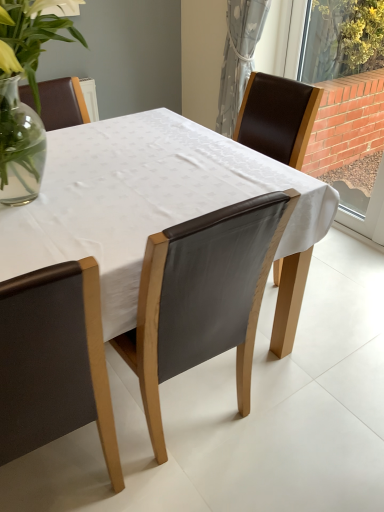
The width and height of the screenshot is (384, 512). Describe the element at coordinates (203, 298) in the screenshot. I see `leather at center, which appears as the second chair when viewed from the left` at that location.

Describe the element at coordinates (238, 57) in the screenshot. I see `gray textured curtain at upper right` at that location.

What is the approximate width of matte brown leather chair at lower left, placed as the 1th chair when sorted from left to right?

10.58 inches.

Find the location of `leather at center, which appears as the second chair when viewed from the left`. leather at center, which appears as the second chair when viewed from the left is located at coordinates (203, 298).

Does point (175, 360) lie in front of point (72, 276)?

No, (175, 360) is further to viewer.

Can you confirm if leather at center, which appears as the second chair when viewed from the left, is bigger than matte brown leather chair at lower left, which is the 2th chair from right to left?

Yes, leather at center, which appears as the second chair when viewed from the left, is bigger than matte brown leather chair at lower left, which is the 2th chair from right to left.

Between leather at center, which appears as the second chair when viewed from the left, and matte brown leather chair at lower left, which is the 2th chair from right to left, which one appears on the right side from the viewer's perspective?

leather at center, which appears as the second chair when viewed from the left.

Considering the sizes of objects matte brown leather chair at lower left, which is the 2th chair from right to left, and leather at center, arranged as the first chair when viewed from the right, in the image provided, who is shorter, matte brown leather chair at lower left, which is the 2th chair from right to left, or leather at center, arranged as the first chair when viewed from the right,?

With less height is leather at center, arranged as the first chair when viewed from the right.

Is matte brown leather chair at lower left, which is the 2th chair from right to left, positioned far away from leather at center, arranged as the first chair when viewed from the right?

Actually, matte brown leather chair at lower left, which is the 2th chair from right to left, and leather at center, arranged as the first chair when viewed from the right, are a little close together.

Is matte brown leather chair at lower left, placed as the 1th chair when sorted from left to right, oriented away from leather at center, which appears as the second chair when viewed from the left?

matte brown leather chair at lower left, placed as the 1th chair when sorted from left to right, is not turned away from leather at center, which appears as the second chair when viewed from the left.

Is leather at center, arranged as the first chair when viewed from the right, placed right next to brick wall at right?

No, leather at center, arranged as the first chair when viewed from the right, is not making contact with brick wall at right.

Looking at their sizes, would you say leather at center, which appears as the second chair when viewed from the left, is wider or thinner than brick wall at right?

Considering their sizes, leather at center, which appears as the second chair when viewed from the left, looks broader than brick wall at right.

Looking at this image, between leather at center, which appears as the second chair when viewed from the left, and brick wall at right, which one has more height?

Standing taller between the two is brick wall at right.

Does point (199, 313) appear closer or farther from the camera than point (316, 140)?

Point (199, 313) appears to be closer to the viewer than point (316, 140).

From a real-world perspective, is brick wall at right above or below leather at center, which appears as the second chair when viewed from the left?

From a real-world perspective, brick wall at right is physically above leather at center, which appears as the second chair when viewed from the left.

Is point (372, 160) positioned before point (150, 435)?

That is False.

Is leather at center, which appears as the second chair when viewed from the left, at the back of brick wall at right?

brick wall at right is not turned away from leather at center, which appears as the second chair when viewed from the left.

Is brick wall at right located outside leather at center, arranged as the first chair when viewed from the right?

Yes, brick wall at right is outside of leather at center, arranged as the first chair when viewed from the right.

From the image's perspective, would you say gray textured curtain at upper right is shown under matte brown leather chair at lower left, placed as the 1th chair when sorted from left to right?

No, from the image's perspective, gray textured curtain at upper right is not beneath matte brown leather chair at lower left, placed as the 1th chair when sorted from left to right.

You are a GUI agent. You are given a task and a screenshot of the screen. Output one action in this format:
    pyautogui.click(x=<x>, y=<y>)
    Task: Click on the curtain above the matte brown leather chair at lower left, placed as the 1th chair when sorted from left to right (from a real-world perspective)
    
    Given the screenshot: What is the action you would take?
    pyautogui.click(x=238, y=57)

Which is in front, point (230, 70) or point (26, 329)?

The point (26, 329) is in front.

Is matte brown leather chair at lower left, placed as the 1th chair when sorted from left to right, surrounding brick wall at right?

No, brick wall at right is located outside of matte brown leather chair at lower left, placed as the 1th chair when sorted from left to right.

Is point (41, 321) farther from camera compared to point (346, 49)?

No, (41, 321) is in front of (346, 49).

What's the angular difference between matte brown leather chair at lower left, placed as the 1th chair when sorted from left to right, and brick wall at right's facing directions?

92.7 degrees.

From a real-world perspective, which is physically below, matte brown leather chair at lower left, which is the 2th chair from right to left, or gray textured curtain at upper right?

matte brown leather chair at lower left, which is the 2th chair from right to left, is physically lower.

Does matte brown leather chair at lower left, placed as the 1th chair when sorted from left to right, lie behind gray textured curtain at upper right?

No.

Is matte brown leather chair at lower left, placed as the 1th chair when sorted from left to right, positioned beyond the bounds of gray textured curtain at upper right?

That's correct, matte brown leather chair at lower left, placed as the 1th chair when sorted from left to right, is outside of gray textured curtain at upper right.

Between matte brown leather chair at lower left, which is the 2th chair from right to left, and gray textured curtain at upper right, which one has smaller size?

With smaller size is gray textured curtain at upper right.

Where is `chair behind the matte brown leather chair at lower left, placed as the 1th chair when sorted from left to right`? chair behind the matte brown leather chair at lower left, placed as the 1th chair when sorted from left to right is located at coordinates (203, 298).

Where is `chair that is in front of the leather at center, arranged as the first chair when viewed from the right`? This screenshot has width=384, height=512. chair that is in front of the leather at center, arranged as the first chair when viewed from the right is located at coordinates (54, 361).

Which object lies nearer to the anchor point gray textured curtain at upper right, matte brown leather chair at lower left, which is the 2th chair from right to left, or white fabric table at center?

The object closer to gray textured curtain at upper right is white fabric table at center.

Considering their positions, is leather at center, which appears as the second chair when viewed from the left, positioned further to brick wall at right than gray textured curtain at upper right?

leather at center, which appears as the second chair when viewed from the left, is further to brick wall at right.

Looking at the image, which one is located further to leather at center, arranged as the first chair when viewed from the right, white fabric table at center or matte brown leather chair at lower left, which is the 2th chair from right to left?

Based on the image, white fabric table at center appears to be further to leather at center, arranged as the first chair when viewed from the right.

Looking at the image, which one is located closer to white fabric table at center, matte brown leather chair at lower left, placed as the 1th chair when sorted from left to right, or brick wall at right?

matte brown leather chair at lower left, placed as the 1th chair when sorted from left to right, is positioned closer to the anchor white fabric table at center.

Looking at the image, which one is located closer to white fabric table at center, brick wall at right or leather at center, arranged as the first chair when viewed from the right?

Among the two, leather at center, arranged as the first chair when viewed from the right, is located nearer to white fabric table at center.

From the image, which object appears to be farther from brick wall at right, white fabric table at center or leather at center, arranged as the first chair when viewed from the right?

Among the two, leather at center, arranged as the first chair when viewed from the right, is located further to brick wall at right.

Based on their spatial positions, is matte brown leather chair at lower left, placed as the 1th chair when sorted from left to right, or white fabric table at center further from leather at center, arranged as the first chair when viewed from the right?

white fabric table at center.

Based on their spatial positions, is gray textured curtain at upper right or brick wall at right closer to matte brown leather chair at lower left, placed as the 1th chair when sorted from left to right?

The object closer to matte brown leather chair at lower left, placed as the 1th chair when sorted from left to right, is gray textured curtain at upper right.

Image resolution: width=384 pixels, height=512 pixels. I want to click on table between gray textured curtain at upper right and matte brown leather chair at lower left, placed as the 1th chair when sorted from left to right, vertically, so click(144, 199).

Locate an element on the screen. This screenshot has height=512, width=384. window between gray textured curtain at upper right and matte brown leather chair at lower left, which is the 2th chair from right to left, in the vertical direction is located at coordinates (345, 105).

Image resolution: width=384 pixels, height=512 pixels. In order to click on chair that lies between gray textured curtain at upper right and matte brown leather chair at lower left, which is the 2th chair from right to left, from top to bottom in this screenshot , I will do `click(203, 298)`.

The height and width of the screenshot is (512, 384). What are the coordinates of `chair between matte brown leather chair at lower left, placed as the 1th chair when sorted from left to right, and brick wall at right from left to right` in the screenshot? It's located at (203, 298).